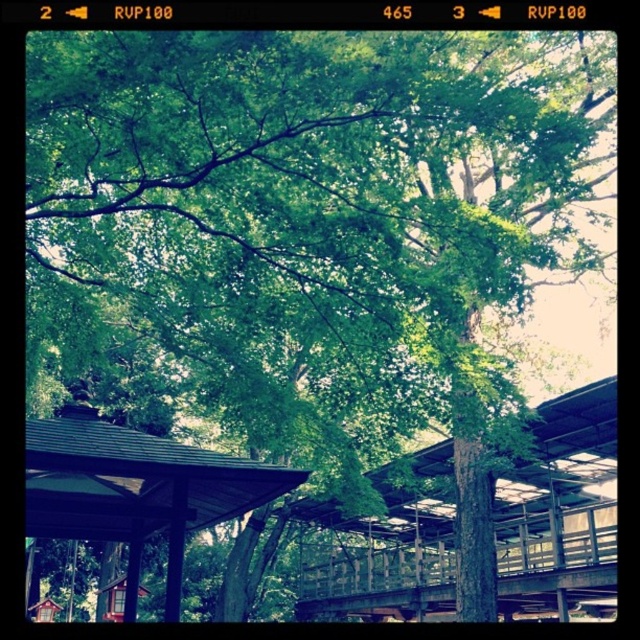
Is metallic gray pavilion at center to the left of brown wooden shelter at lower left from the viewer's perspective?

Incorrect, metallic gray pavilion at center is not on the left side of brown wooden shelter at lower left.

Which is more to the right, metallic gray pavilion at center or brown wooden shelter at lower left?

From the viewer's perspective, metallic gray pavilion at center appears more on the right side.

Between point (394, 604) and point (84, 468), which one is positioned in front?

Point (84, 468)

Find the location of `metallic gray pavilion at center`. metallic gray pavilion at center is located at coordinates (561, 506).